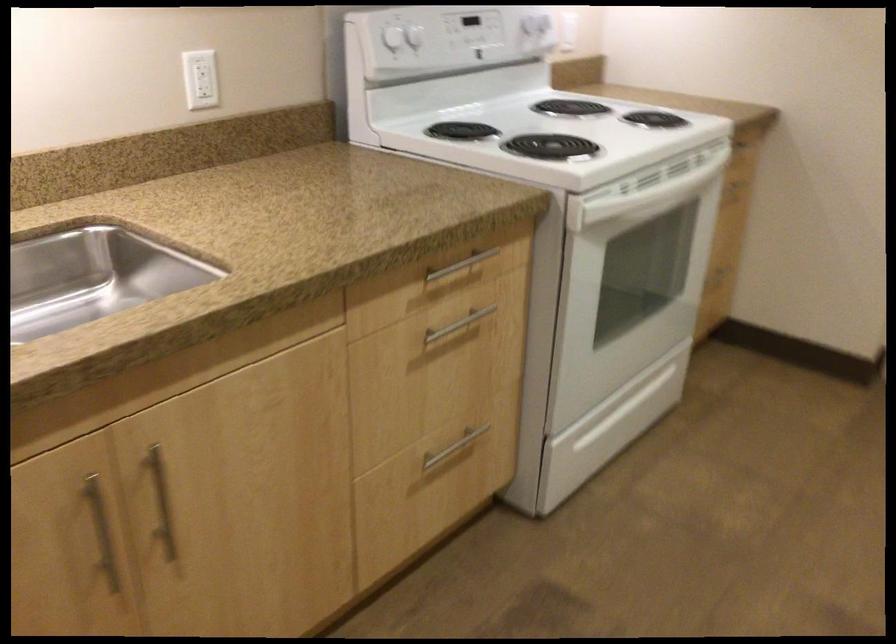
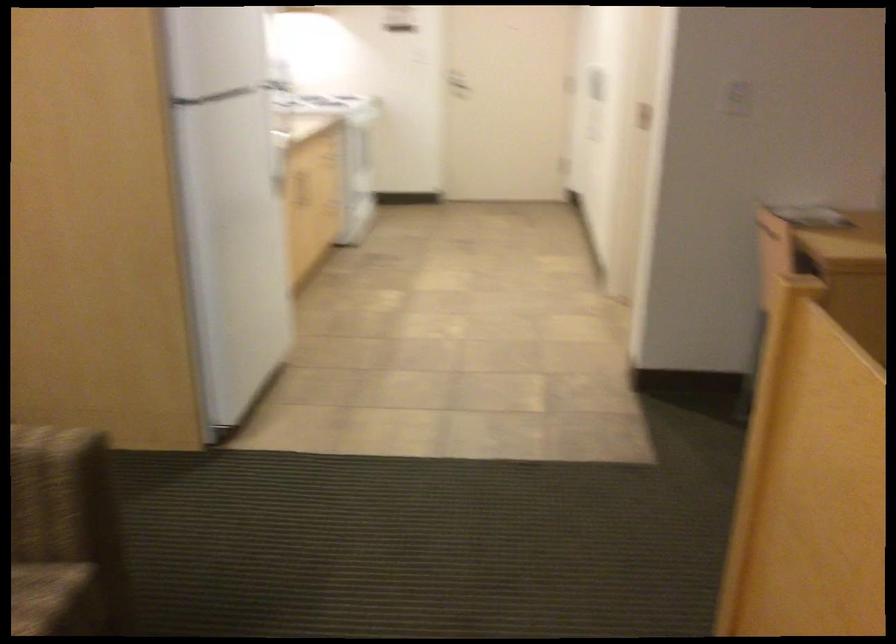
Question: I am providing you with two images of the same scene from different viewpoints. Please identify which objects are invisible in image2.

Choices:
 (A) wooden cabinet handle
 (B) door handle
 (C) jump rope handle
 (D) white stove knob

Answer: (D)